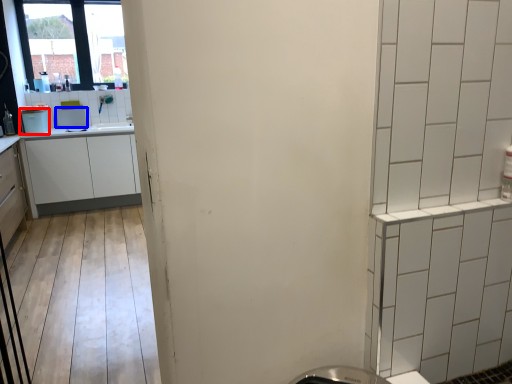
Question: Among these objects, which one is farthest to the camera, appliance (highlighted by a red box) or appliance (highlighted by a blue box)?

Choices:
 (A) appliance
 (B) appliance

Answer: (B)